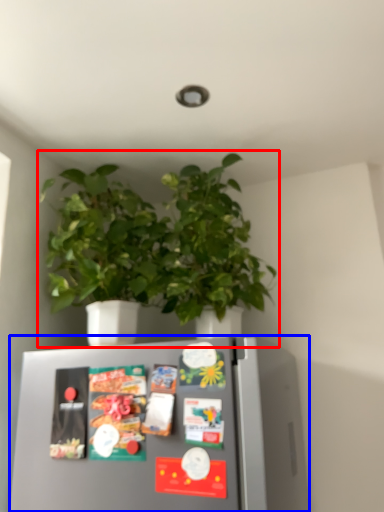
Question: Among these objects, which one is nearest to the camera, houseplant (highlighted by a red box) or refrigerator (highlighted by a blue box)?

Choices:
 (A) houseplant
 (B) refrigerator

Answer: (B)